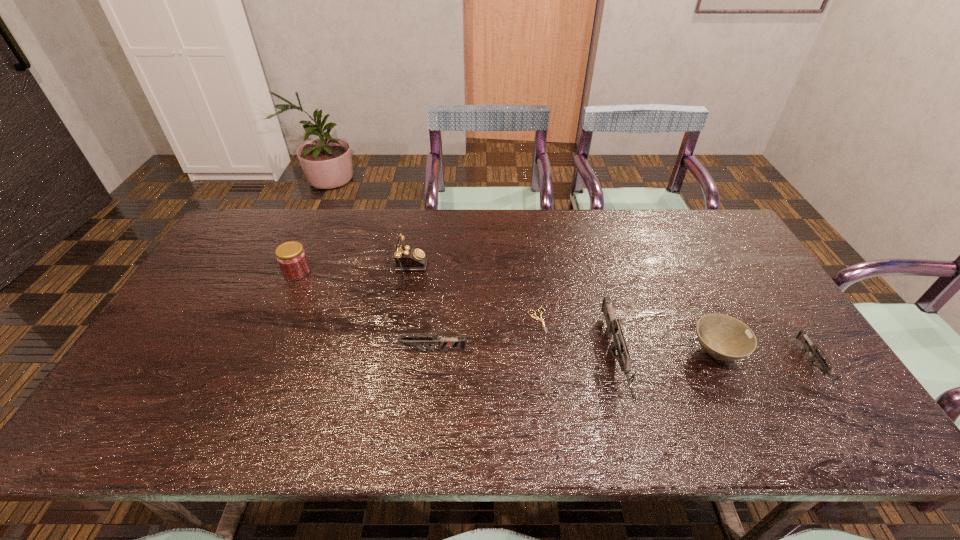
Locate an element on the screen. This screenshot has width=960, height=540. free spot at the far edge of the desktop is located at coordinates (568, 245).

The width and height of the screenshot is (960, 540). In the image, there is a desktop. What are the coordinates of `vacant space at the near edge` in the screenshot? It's located at (700, 382).

Locate an element on the screen. Image resolution: width=960 pixels, height=540 pixels. vacant space at the left edge is located at coordinates (225, 325).

Where is `vacant space at the right edge of the desktop`? This screenshot has width=960, height=540. vacant space at the right edge of the desktop is located at coordinates (735, 253).

Locate an element on the screen. The width and height of the screenshot is (960, 540). vacant space at the far left corner of the desktop is located at coordinates (223, 244).

Image resolution: width=960 pixels, height=540 pixels. In the image, there is a desktop. Find the location of `vacant area at the near right corner`. vacant area at the near right corner is located at coordinates (804, 375).

At what (x,y) coordinates should I click in order to perform the action: click on empty space that is in between the second shortest object and the bowl. Please return your answer as a coordinate pair (x, y). The image size is (960, 540). Looking at the image, I should click on (765, 360).

Locate an element on the screen. This screenshot has width=960, height=540. free space between the shortest object and the telephone is located at coordinates (468, 300).

Find the location of a particular element. free space between the fourth object from right to left and the second gun from left to right is located at coordinates (576, 340).

Identify the location of unoccupied area between the telephone and the leftmost object. The image size is (960, 540). (347, 275).